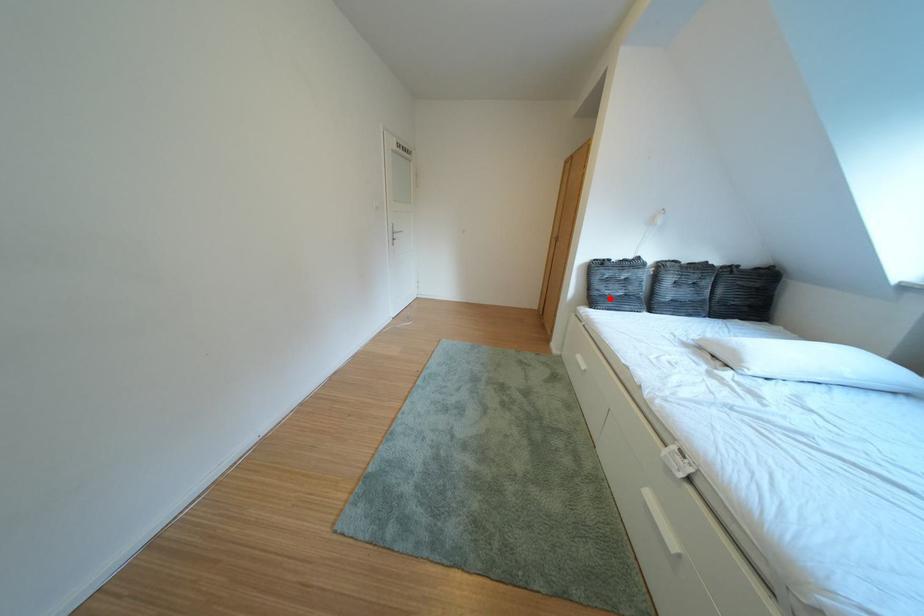
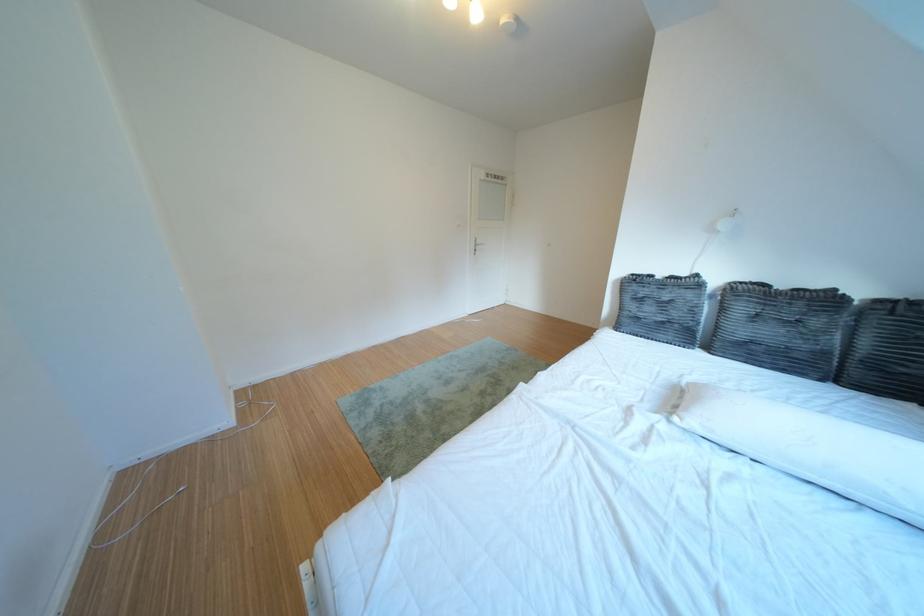
In the second image, find the point that corresponds to the highlighted location in the first image.

(639, 318)